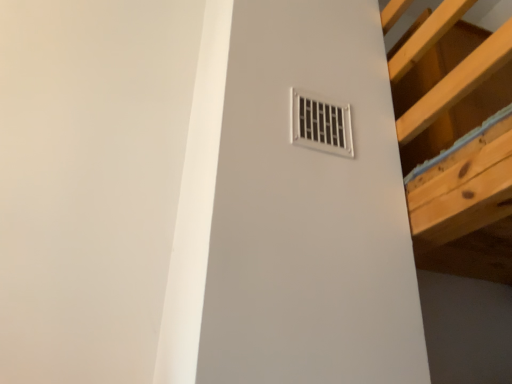
In order to face white plastic vent at upper right, should I rotate leftwards or rightwards?

Rotate your view right by about 9.276°.

The width and height of the screenshot is (512, 384). What do you see at coordinates (321, 124) in the screenshot? I see `white plastic vent at upper right` at bounding box center [321, 124].

The height and width of the screenshot is (384, 512). I want to click on white plastic vent at upper right, so click(321, 124).

This screenshot has height=384, width=512. Find the location of `white plastic vent at upper right`. white plastic vent at upper right is located at coordinates (321, 124).